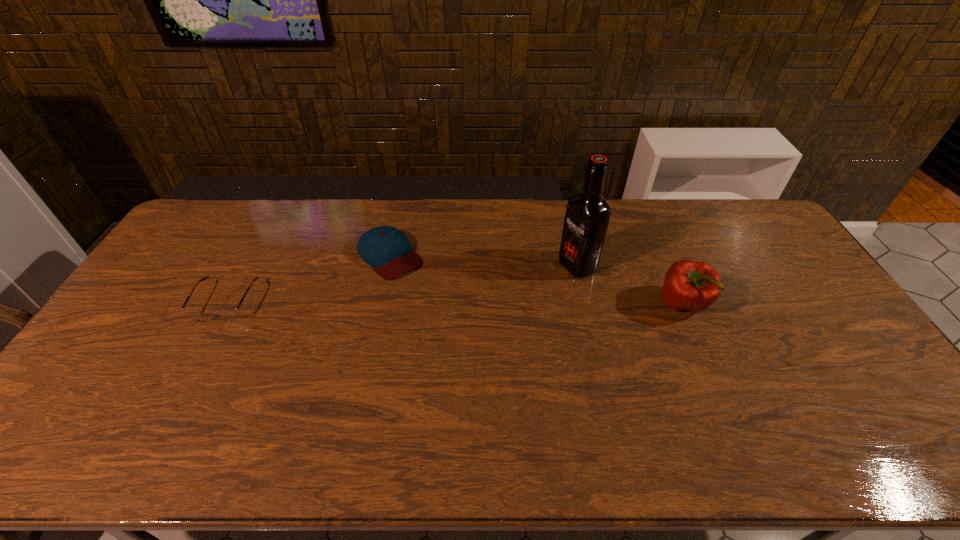
Locate an element on the screen. free space at the right edge is located at coordinates (790, 319).

You are a GUI agent. You are given a task and a screenshot of the screen. Output one action in this format:
    pyautogui.click(x=<x>, y=<y>)
    Task: Click on the vacant area at the far right corner
    Image resolution: width=960 pixels, height=540 pixels.
    Given the screenshot: What is the action you would take?
    [757, 209]

What are the coordinates of `vacant area between the leftmost object and the third object from right to left` in the screenshot? It's located at (308, 279).

What are the coordinates of `free space between the baseball cap and the leftmost object` in the screenshot? It's located at (308, 279).

Where is `free space that is in between the third object from left to right and the leftmost object`? free space that is in between the third object from left to right and the leftmost object is located at coordinates (401, 284).

This screenshot has width=960, height=540. In order to click on free space between the tallest object and the third tallest object in this screenshot , I will do `click(484, 260)`.

Identify the location of unoccupied position between the third shortest object and the spectacles. pos(454,302).

Find the location of a particular element. vacant space in between the second shortest object and the third shortest object is located at coordinates (537, 280).

You are a GUI agent. You are given a task and a screenshot of the screen. Output one action in this format:
    pyautogui.click(x=<x>, y=<y>)
    Task: Click on the empty space that is in between the baseball cap and the leftmost object
    This screenshot has width=960, height=540.
    Given the screenshot: What is the action you would take?
    (x=308, y=279)

Identify the location of vacant area between the rightmost object and the second object from right to left. (630, 285).